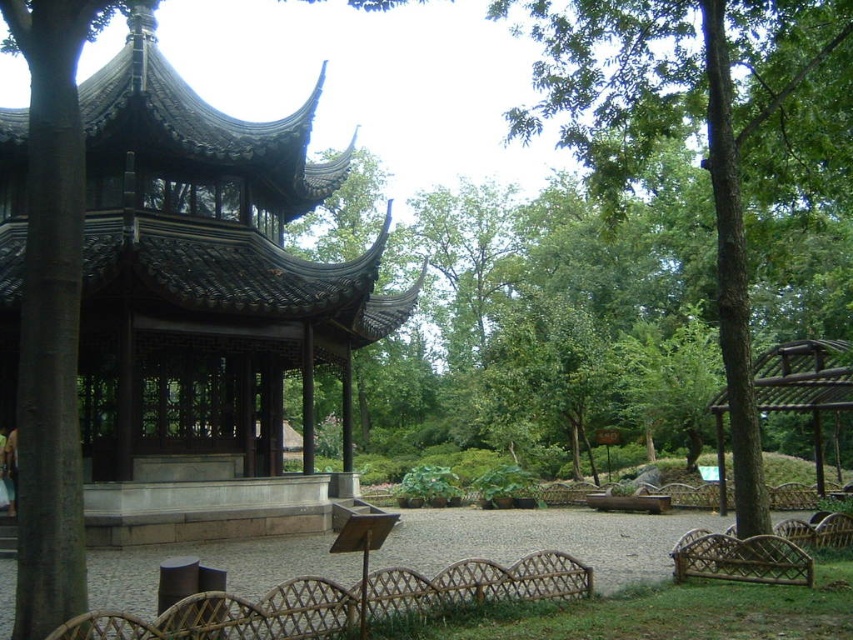
You are standing in front of a traditional Chinese garden and want to take a photo of the dark brown wood gazebo at center. If your camera has a maximum focus range of 18 feet, will you be able to capture the gazebo clearly?

The dark brown wood gazebo at center is 18.16 feet away from the camera, which exceeds the maximum focus range of 18 feet. Therefore, the camera may not be able to focus clearly on the gazebo.

You are planning to host a small gathering in the serene outdoor setting. The dark brown wood gazebo at center and the green leafy tree at center are both potential locations. Based on their sizes, which location can accommodate more guests?

The green leafy tree at center can accommodate more guests because it occupies more space than the dark brown wood gazebo at center.